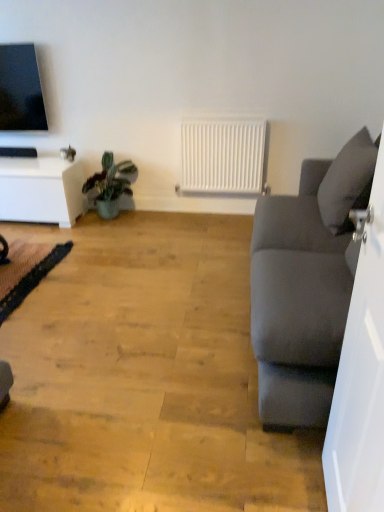
Identify the location of unoccupied area in front of green matte plant at lower left. This screenshot has width=384, height=512. (100, 233).